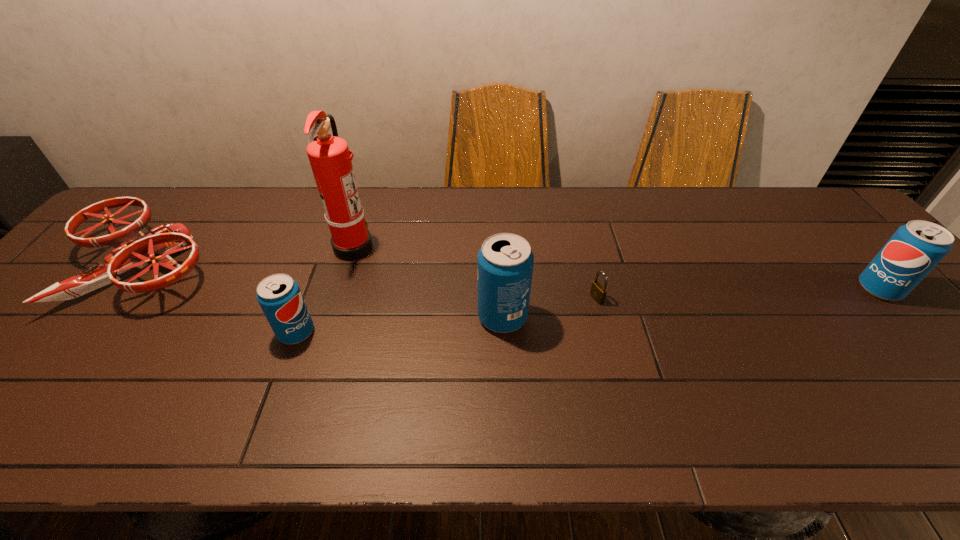
Identify the location of free space located 0.280m on the right of the shortest soda can. Image resolution: width=960 pixels, height=540 pixels. (434, 332).

Where is `free spot located 0.370m on the back of the third object from right to left`? The image size is (960, 540). free spot located 0.370m on the back of the third object from right to left is located at coordinates (497, 211).

Find the location of a particular element. vacant space positioned 0.390m on the back of the third tallest object is located at coordinates (793, 191).

You are a GUI agent. You are given a task and a screenshot of the screen. Output one action in this format:
    pyautogui.click(x=<x>, y=<y>)
    Task: Click on the vacant space positioned on the right of the leftmost object
    The height and width of the screenshot is (540, 960).
    Given the screenshot: What is the action you would take?
    pyautogui.click(x=247, y=267)

Image resolution: width=960 pixels, height=540 pixels. Identify the location of free space located at the nozzle of the fire extinguisher. [x=441, y=246].

This screenshot has width=960, height=540. I want to click on free space located on the back of the padlock, so click(575, 212).

Identify the location of drone that is at the far edge. This screenshot has height=540, width=960. (135, 249).

You are a GUI agent. You are given a task and a screenshot of the screen. Output one action in this format:
    pyautogui.click(x=<x>, y=<y>)
    Task: Click on the fire extinguisher at the far edge
    
    Given the screenshot: What is the action you would take?
    pyautogui.click(x=329, y=156)

Where is `object at the left edge`? The width and height of the screenshot is (960, 540). object at the left edge is located at coordinates (135, 249).

The width and height of the screenshot is (960, 540). Find the location of `object located at the right edge`. object located at the right edge is located at coordinates (917, 247).